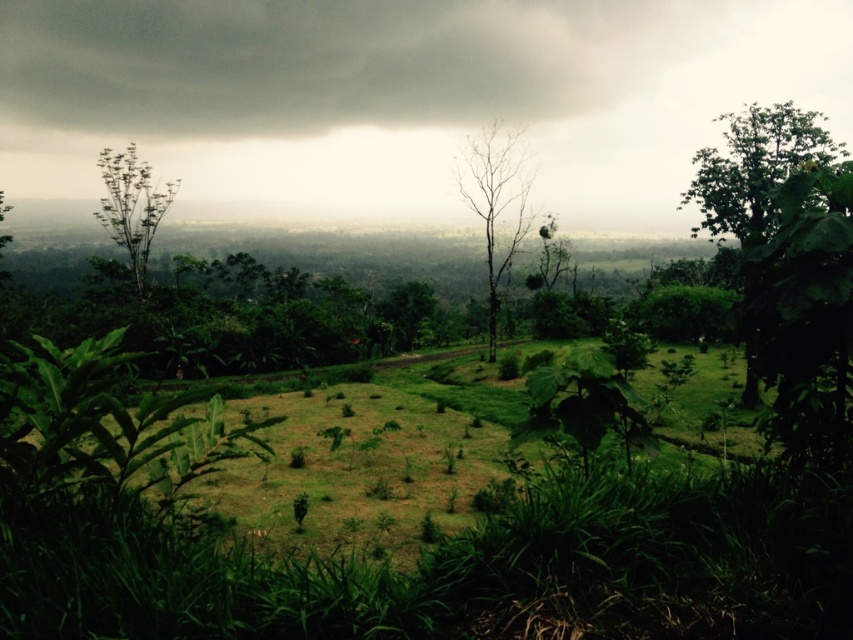
Question: Is the position of bare wood tree at center more distant than that of green leafy tree at left?

Choices:
 (A) yes
 (B) no

Answer: (B)

Question: Based on their relative distances, which object is nearer to the bare wood tree at center?

Choices:
 (A) green leafy tree at left
 (B) green leafy tree at right

Answer: (B)

Question: Does green leafy tree at right come in front of bare wood tree at center?

Choices:
 (A) yes
 (B) no

Answer: (A)

Question: Estimate the real-world distances between objects in this image. Which object is closer to the bare wood tree at center?

Choices:
 (A) green leafy tree at left
 (B) green leafy tree at right

Answer: (B)

Question: Does green leafy tree at right have a greater width compared to bare wood tree at center?

Choices:
 (A) yes
 (B) no

Answer: (A)

Question: Which object is the farthest from the green leafy tree at left?

Choices:
 (A) bare wood tree at center
 (B) green leafy tree at right

Answer: (B)